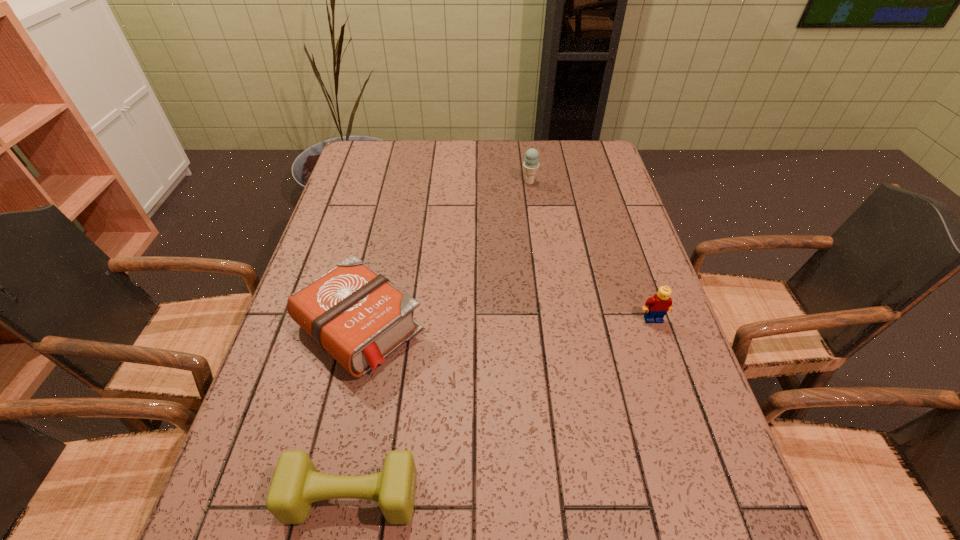
The height and width of the screenshot is (540, 960). I want to click on blank region between the third object from left to right and the Bible, so click(444, 255).

Locate an element on the screen. The width and height of the screenshot is (960, 540). free spot between the Lego and the third object from left to right is located at coordinates (591, 251).

The height and width of the screenshot is (540, 960). Identify the location of free space between the ice cream and the Bible. tap(444, 255).

The width and height of the screenshot is (960, 540). Identify the location of vacant space that is in between the Lego and the Bible. (506, 323).

The width and height of the screenshot is (960, 540). In order to click on free space between the rightmost object and the ice cream in this screenshot , I will do point(591,251).

Image resolution: width=960 pixels, height=540 pixels. In order to click on unoccupied area between the Bible and the ice cream in this screenshot , I will do `click(444, 255)`.

Identify which object is the third closest to the nearest object. Please provide its 2D coordinates. Your answer should be formatted as a tuple, i.e. [(x, y)], where the tuple contains the x and y coordinates of a point satisfying the conditions above.

[(530, 165)]

Where is `the closest object to the Lego`? This screenshot has width=960, height=540. the closest object to the Lego is located at coordinates click(358, 316).